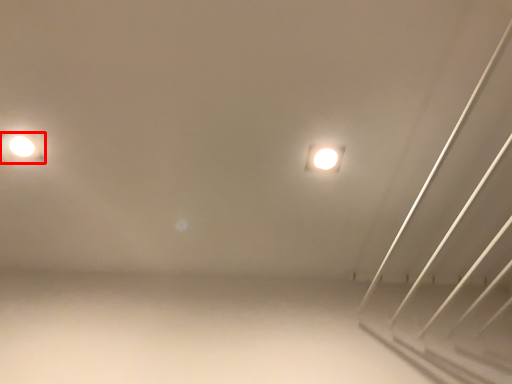
Question: From the image's perspective, where is lamp (annotated by the red box) located relative to lamp?

Choices:
 (A) above
 (B) below

Answer: (A)